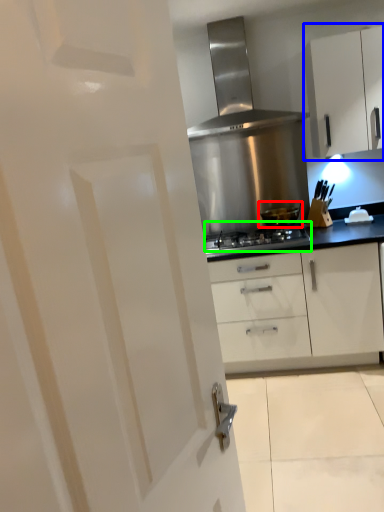
Question: Considering the real-world distances, which object is farthest from kitchen appliance (highlighted by a red box)? cabinetry (highlighted by a blue box) or gas stove (highlighted by a green box)?

Choices:
 (A) cabinetry
 (B) gas stove

Answer: (A)